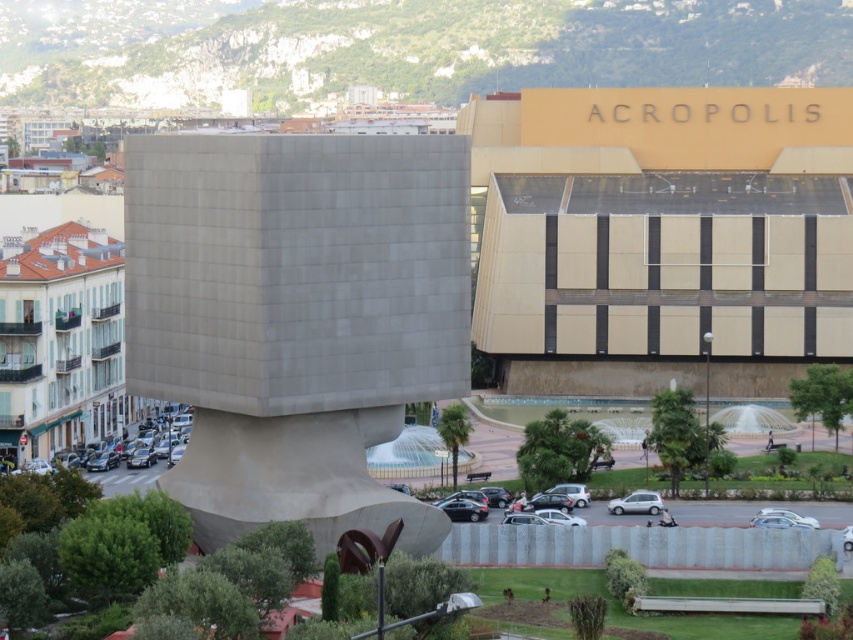
In the scene shown: You are a tourist standing in the urban landscape and want to take a photo of both the green painted wood hotel at left and the shiny black car at lower left. Since you want both to be in the frame, which object should you position closer to the camera to include both in your photo?

The green painted wood hotel at left is larger than the shiny black car at lower left. To include both in the frame, you should position the shiny black car at lower left closer to the camera since it is smaller and needs to be enlarged in the photo to match the scale of the larger hotel.